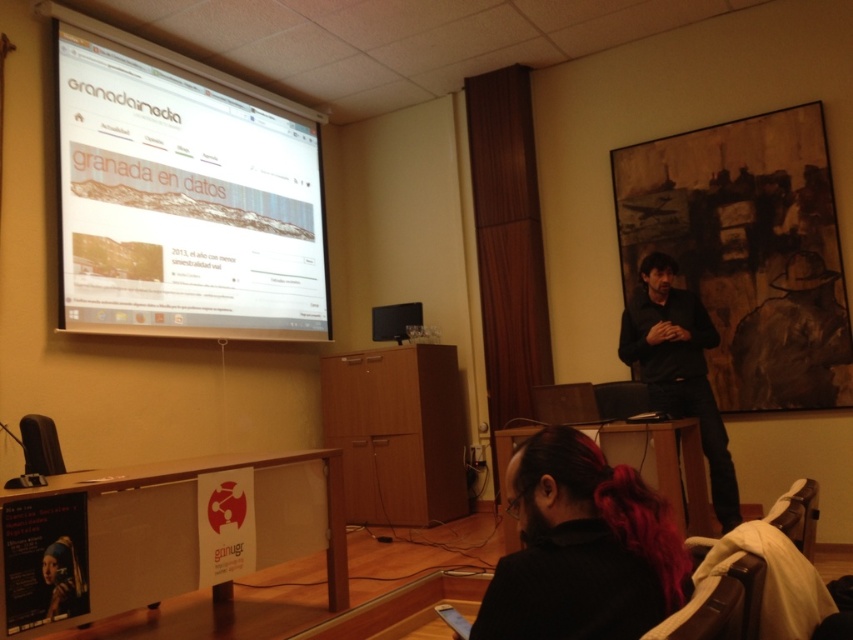
Which is behind, point (192, 212) or point (709, 422)?

The point (192, 212) is behind.

Is point (59, 40) less distant than point (659, 305)?

Yes.

Between point (242, 294) and point (712, 435), which one is positioned in front?

Positioned in front is point (712, 435).

Where is `white glossy projector screen at upper left`? white glossy projector screen at upper left is located at coordinates (183, 204).

Does white glossy projector screen at upper left appear on the right side of dark hair at lower center?

Incorrect, white glossy projector screen at upper left is not on the right side of dark hair at lower center.

Does point (229, 330) come closer to viewer compared to point (590, 497)?

No, (229, 330) is further to viewer.

Image resolution: width=853 pixels, height=640 pixels. In order to click on white glossy projector screen at upper left in this screenshot , I will do `click(183, 204)`.

Which of these two, dark hair at lower center or black matte shirt at center, stands shorter?

Standing shorter between the two is dark hair at lower center.

Which is more to the left, dark hair at lower center or black matte shirt at center?

From the viewer's perspective, dark hair at lower center appears more on the left side.

At what (x,y) coordinates should I click in order to perform the action: click on dark hair at lower center. Please return your answer as a coordinate pair (x, y). This screenshot has width=853, height=640. Looking at the image, I should click on (582, 548).